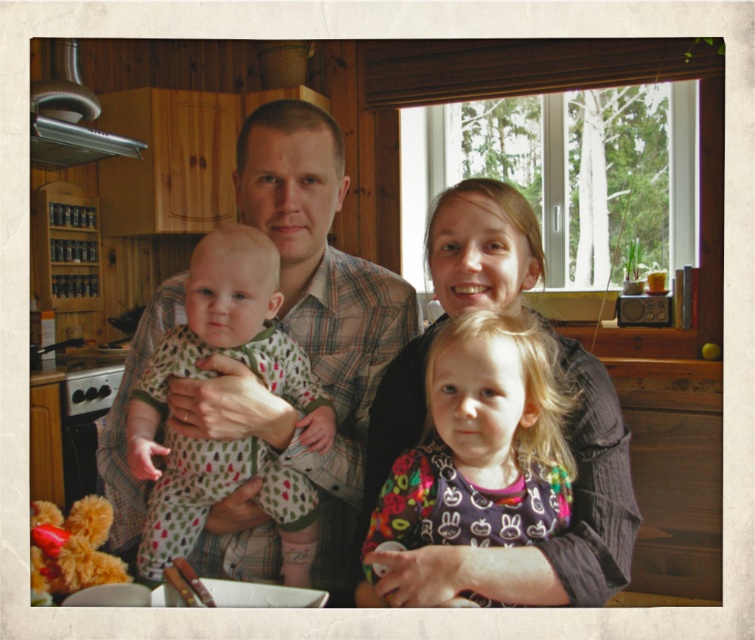
Is matte black shirt at center smaller than printed cotton onesie at center?

Incorrect, matte black shirt at center is not smaller in size than printed cotton onesie at center.

Can you confirm if matte black shirt at center is bigger than printed cotton onesie at center?

Yes.

You are a GUI agent. You are given a task and a screenshot of the screen. Output one action in this format:
    pyautogui.click(x=<x>, y=<y>)
    Task: Click on the matte black shirt at center
    
    Given the screenshot: What is the action you would take?
    pyautogui.click(x=559, y=531)

Does point (393, 346) lie behind point (436, 566)?

Yes, it is behind point (436, 566).

The width and height of the screenshot is (755, 640). I want to click on plaid shirt at center, so click(x=307, y=317).

Between point (260, 209) and point (575, 481), which one is positioned behind?

Positioned behind is point (260, 209).

Where is `plaid shirt at center`? This screenshot has height=640, width=755. plaid shirt at center is located at coordinates (307, 317).

Who is shorter, plaid shirt at center or printed cotton onesie at center?

Standing shorter between the two is printed cotton onesie at center.

I want to click on plaid shirt at center, so click(x=307, y=317).